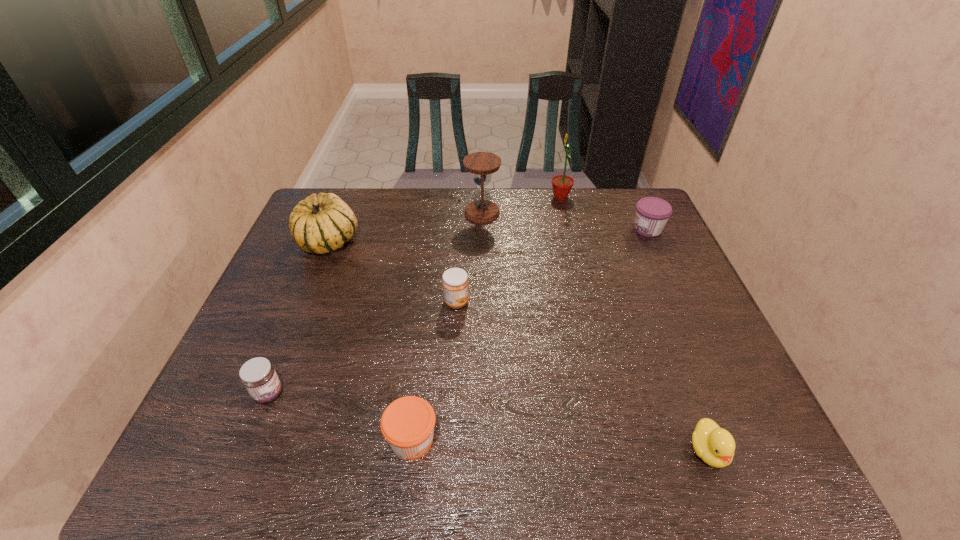
Find the location of a particular element. vacant space that is in between the gourd and the nearest jam is located at coordinates (371, 341).

You are a GUI agent. You are given a task and a screenshot of the screen. Output one action in this format:
    pyautogui.click(x=<x>, y=<y>)
    Task: Click on the vacant point located between the duckling and the nearest jam
    The height and width of the screenshot is (540, 960).
    Given the screenshot: What is the action you would take?
    pyautogui.click(x=560, y=446)

I want to click on free space between the fourth nearest object and the leftmost jam, so click(x=363, y=348).

Where is `unoccupied position between the third nearest jam and the duckling`? The width and height of the screenshot is (960, 540). unoccupied position between the third nearest jam and the duckling is located at coordinates (582, 376).

Image resolution: width=960 pixels, height=540 pixels. I want to click on unoccupied position between the duckling and the hourglass, so click(595, 332).

Find the location of a particular element. The width and height of the screenshot is (960, 540). free space between the fifth farthest object and the sixth shortest object is located at coordinates click(x=393, y=272).

Where is `free area in between the farthest jam and the third farthest jam`? The width and height of the screenshot is (960, 540). free area in between the farthest jam and the third farthest jam is located at coordinates (458, 311).

Locate an element on the screen. The width and height of the screenshot is (960, 540). vacant area that lies between the second farthest jam and the duckling is located at coordinates (582, 376).

At what (x,y) coordinates should I click in order to perform the action: click on the fourth closest object relative to the second nearest jam. Please return your answer as a coordinate pair (x, y). The image size is (960, 540). Looking at the image, I should click on (481, 164).

Locate which object ranks second in proximity to the duckling. Please provide its 2D coordinates. Your answer should be formatted as a tuple, i.e. [(x, y)], where the tuple contains the x and y coordinates of a point satisfying the conditions above.

[(455, 283)]